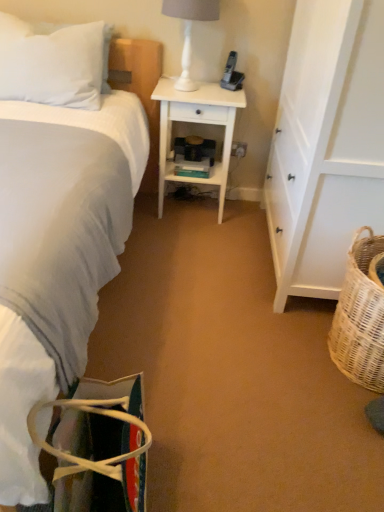
Locate an element on the screen. The image size is (384, 512). free space in front of woven wicker basket at lower right is located at coordinates (331, 440).